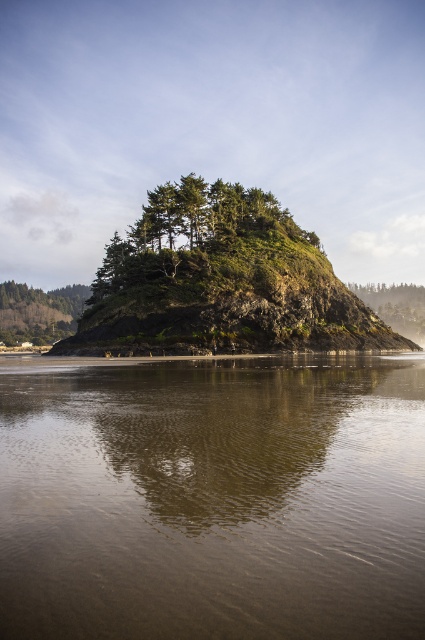
Between green textured rock at center and green matte tree at left, which one has more height?

Standing taller between the two is green matte tree at left.

At what (x,y) coordinates should I click in order to perform the action: click on green textured rock at center. Please return your answer as a coordinate pair (x, y). The image size is (425, 640). Looking at the image, I should click on (201, 241).

Which is more to the left, brown reflective water at center or green matte tree at left?

From the viewer's perspective, green matte tree at left appears more on the left side.

Describe the element at coordinates (212, 497) in the screenshot. I see `brown reflective water at center` at that location.

Identify the location of brown reflective water at center. (212, 497).

Does foggy mist at upper center have a smaller size compared to green textured rock at center?

No.

Measure the distance between foggy mist at upper center and camera.

282.82 feet

Measure the distance between point (238,44) and camera.

A distance of 423.32 meters exists between point (238,44) and camera.

Identify the location of foggy mist at upper center. pyautogui.click(x=210, y=122).